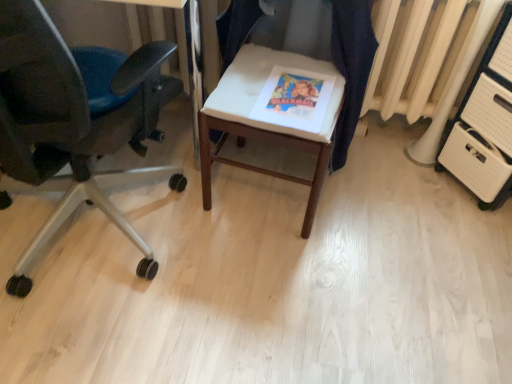
This screenshot has height=384, width=512. I want to click on free spot to the right of white fabric chair at center, so click(x=377, y=204).